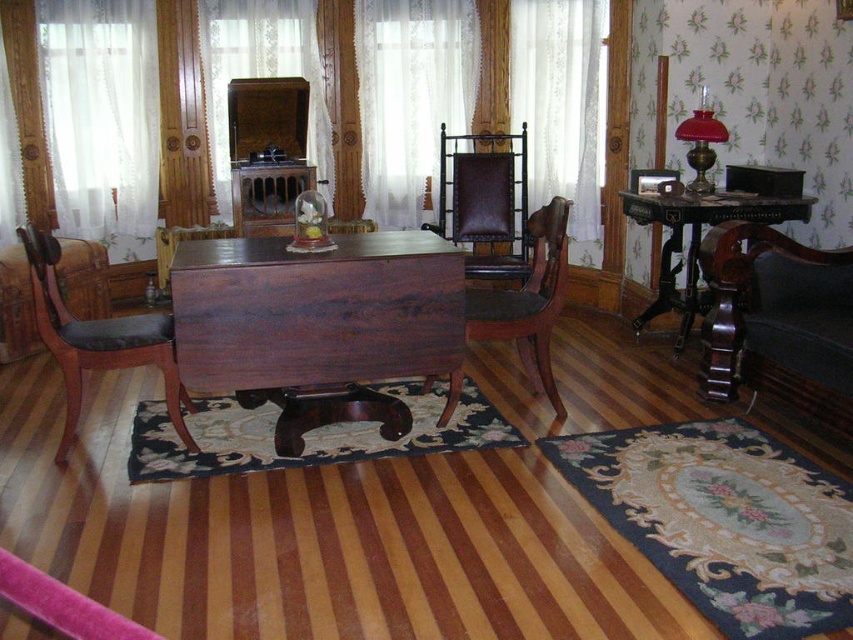
Is point (486, 179) positioned in front of point (480, 333)?

No, (486, 179) is further to viewer.

This screenshot has width=853, height=640. Describe the element at coordinates (485, 202) in the screenshot. I see `brown leather armchair at center` at that location.

Does point (467, 225) come behind point (544, 340)?

Yes, it is behind point (544, 340).

Find the location of a particular element. brown leather armchair at center is located at coordinates (485, 202).

Is dark brown leather armchair at right below mahogany leather armchair at left?

Actually, dark brown leather armchair at right is above mahogany leather armchair at left.

The height and width of the screenshot is (640, 853). I want to click on dark brown leather armchair at right, so click(x=778, y=321).

Does mahogany wood table at center appear on the left side of black marble table at right?

Correct, you'll find mahogany wood table at center to the left of black marble table at right.

Between point (209, 243) and point (691, 305), which one is positioned behind?

The point (691, 305) is more distant.

Does point (242, 276) come farther from viewer compared to point (648, 218)?

No, (242, 276) is in front of (648, 218).

At what (x,y) coordinates should I click in order to perform the action: click on mahogany wood table at center. Please return your answer as a coordinate pair (x, y). Looking at the image, I should click on (318, 324).